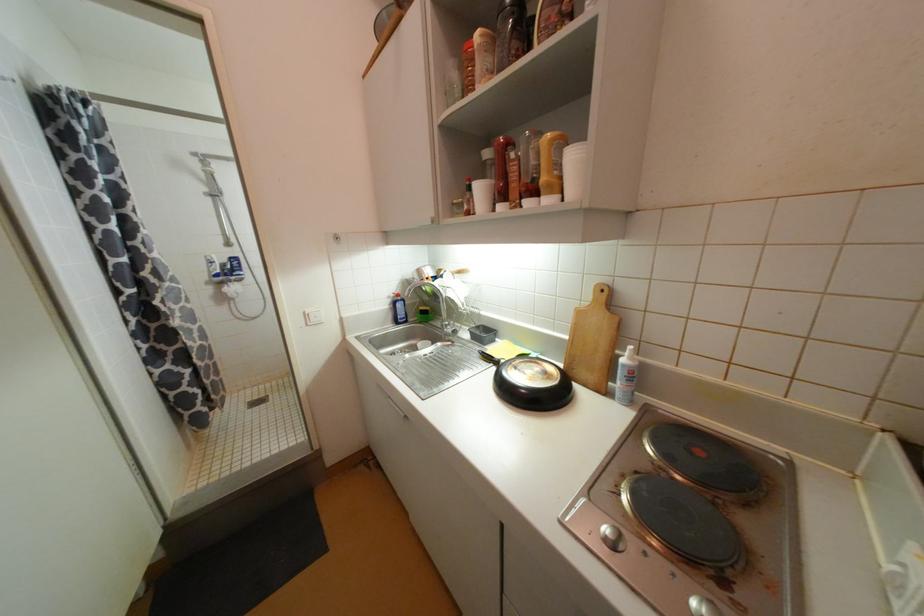
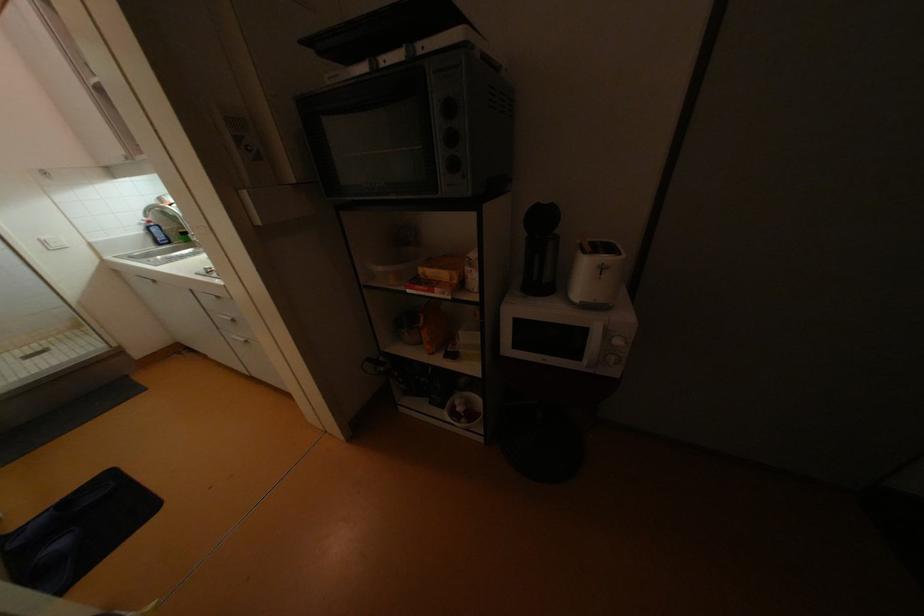
In a continuous first-person perspective shot, in which direction is the camera moving?

The cameraman moved toward right, backward.